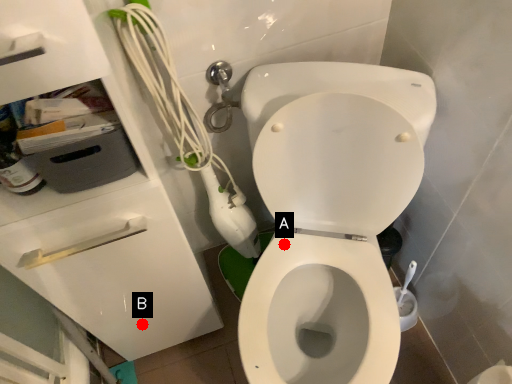
Question: Two points are circled on the image, labeled by A and B beside each circle. Which point is closer to the camera taking this photo?

Choices:
 (A) A is closer
 (B) B is closer

Answer: (A)